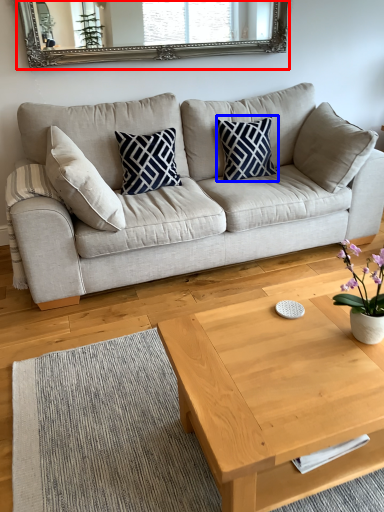
Question: Which object appears closest to the camera in this image, mirror (highlighted by a red box) or pillow (highlighted by a blue box)?

Choices:
 (A) mirror
 (B) pillow

Answer: (A)